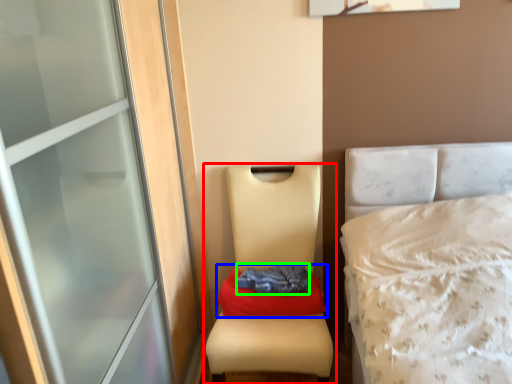
Question: Based on their relative distances, which object is nearer to furniture (highlighted by a red box)? Choose from material (highlighted by a blue box) and clothing (highlighted by a green box).

Choices:
 (A) material
 (B) clothing

Answer: (B)